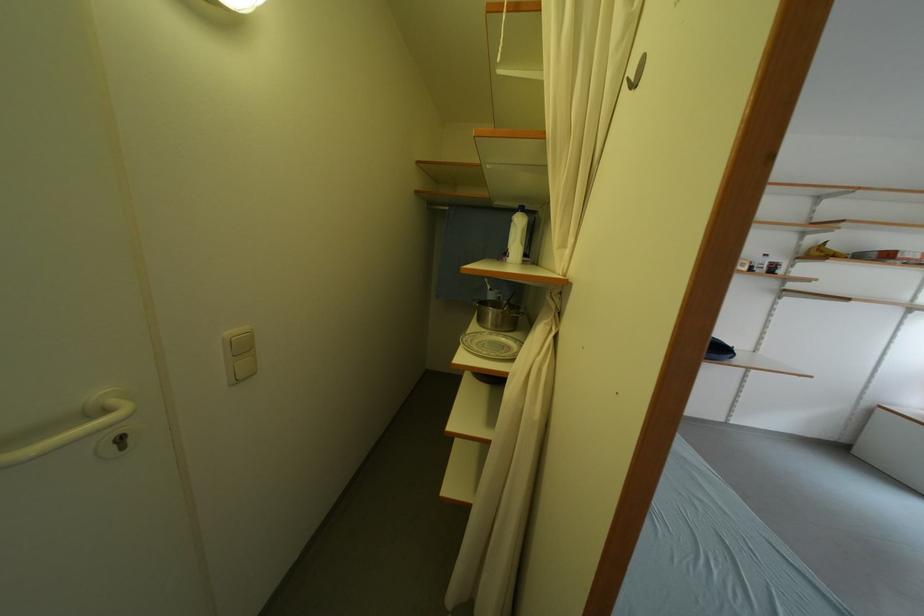
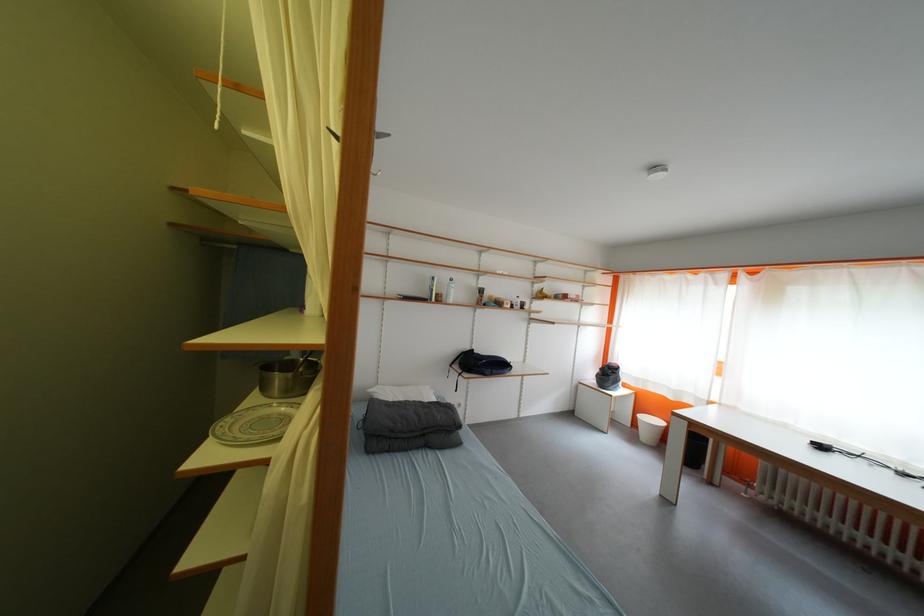
Question: The camera is either moving clockwise (left) or counter-clockwise (right) around the object. The first image is from the beginning of the video and the second image is from the end. Is the camera moving left or right when shooting the video?

Choices:
 (A) Left
 (B) Right

Answer: (A)